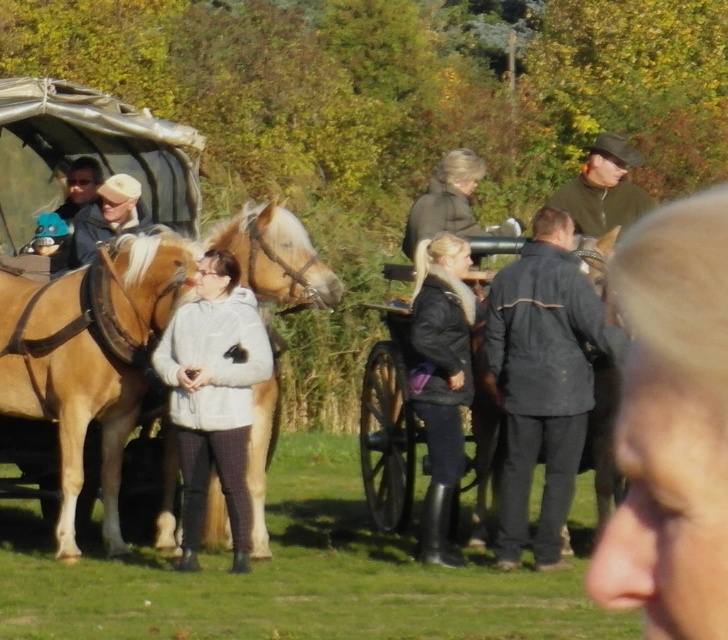
Which is in front, point (103, 419) or point (472, 401)?

Point (472, 401)

Does light brown leather horse at center appear under wooden wagon at center?

Actually, light brown leather horse at center is above wooden wagon at center.

Identify the location of light brown leather horse at center. (68, 394).

Who is positioned more to the right, black leather jacket at center or green woolen hat at upper right?

green woolen hat at upper right

This screenshot has width=728, height=640. Find the location of `black leather jacket at center`. black leather jacket at center is located at coordinates (x=440, y=380).

Locate an element on the screen. The height and width of the screenshot is (640, 728). black leather jacket at center is located at coordinates (440, 380).

Locate an element on the screen. black leather jacket at center is located at coordinates (440, 380).

Does smooth beige coat at center have a larger size compared to light brown leather hat at upper left?

Yes.

Is smooth beige coat at center to the right of light brown leather hat at upper left from the viewer's perspective?

Yes, smooth beige coat at center is to the right of light brown leather hat at upper left.

This screenshot has height=640, width=728. Describe the element at coordinates (670, 422) in the screenshot. I see `smooth beige coat at center` at that location.

This screenshot has height=640, width=728. What are the coordinates of `smooth beige coat at center` in the screenshot? It's located at (670, 422).